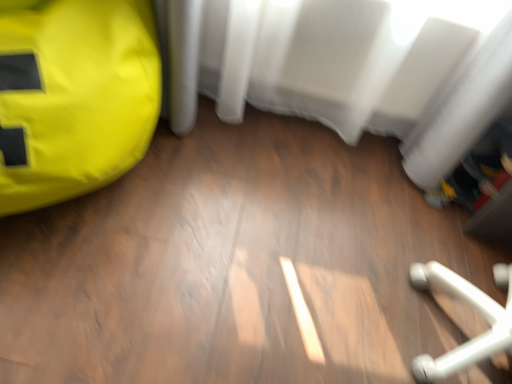
Question: Considering the positions of yellow fabric bean bag at left and white sheer curtain at upper center in the image, is yellow fabric bean bag at left bigger or smaller than white sheer curtain at upper center?

Choices:
 (A) small
 (B) big

Answer: (B)

Question: From a real-world perspective, is yellow fabric bean bag at left above or below white sheer curtain at upper center?

Choices:
 (A) below
 (B) above

Answer: (A)

Question: Does point (138, 67) appear closer or farther from the camera than point (501, 77)?

Choices:
 (A) farther
 (B) closer

Answer: (B)

Question: Relative to yellow fabric bean bag at left, is white sheer curtain at upper center in front or behind?

Choices:
 (A) behind
 (B) front

Answer: (A)

Question: Considering the positions of white sheer curtain at upper center and yellow fabric bean bag at left in the image, is white sheer curtain at upper center taller or shorter than yellow fabric bean bag at left?

Choices:
 (A) tall
 (B) short

Answer: (B)

Question: Is white sheer curtain at upper center inside or outside of yellow fabric bean bag at left?

Choices:
 (A) inside
 (B) outside

Answer: (B)

Question: From a real-world perspective, is white sheer curtain at upper center positioned above or below yellow fabric bean bag at left?

Choices:
 (A) below
 (B) above

Answer: (B)